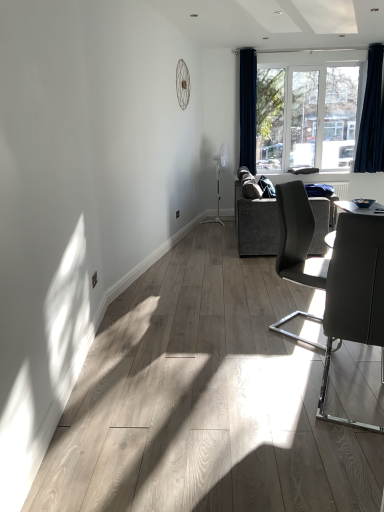
Where is `blank area to the left of matte gray chair at center right, which is the first chair from back to front`? This screenshot has height=512, width=384. blank area to the left of matte gray chair at center right, which is the first chair from back to front is located at coordinates (247, 329).